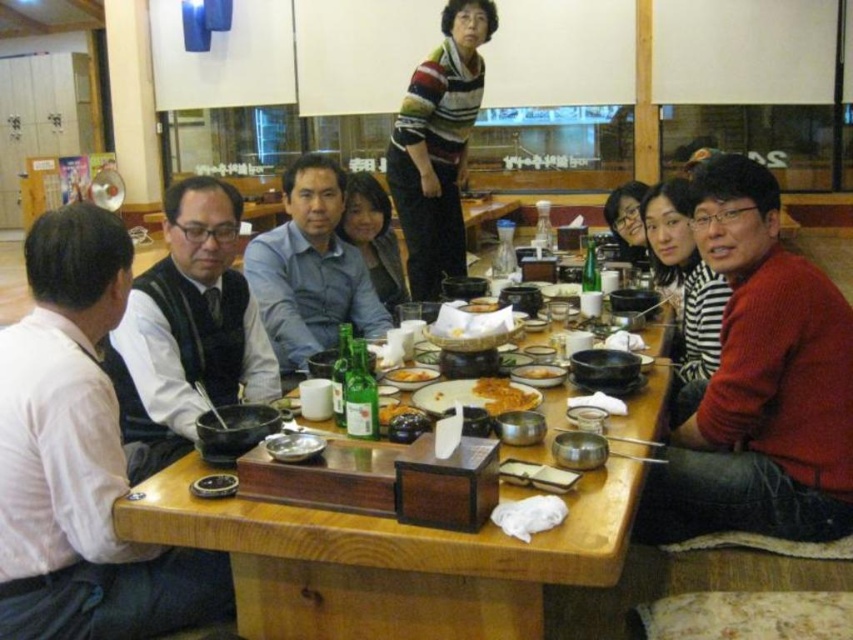
You are sitting at a table in a Korean restaurant and want to pass a dish to the person wearing the white shirt at left and the blue cotton shirt at center. Which person is seated closer to you?

The white shirt at left is closer to the viewer than the blue cotton shirt at center, so the person wearing the white shirt at left is seated closer to you.